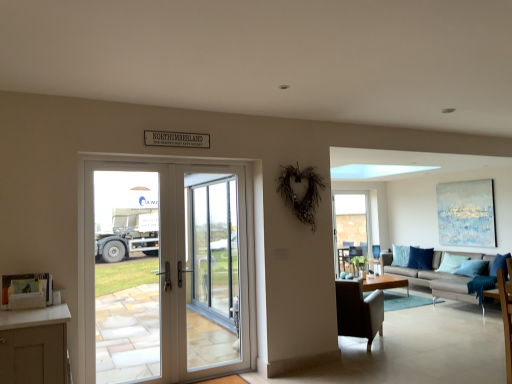
Find the location of a particular element. This screenshot has height=384, width=512. brown leather chair at center is located at coordinates (359, 310).

Identify the location of light gray fabric couch at center. The width and height of the screenshot is (512, 384). (438, 276).

At what (x,y) coordinates should I click in order to perform the action: click on clear glass window at right. Please return your answer as a coordinate pair (x, y). The image size is (512, 384). Looking at the image, I should click on (351, 223).

Does brown leather chair at center lie behind clear glass window at right?

No, it is in front of clear glass window at right.

From the image's perspective, relative to clear glass window at right, is brown leather chair at center above or below?

brown leather chair at center is situated lower than clear glass window at right in the image.

Which object is wider, brown leather chair at center or clear glass window at right?

brown leather chair at center.

Between brown leather chair at center and clear glass window at right, which one appears on the right side from the viewer's perspective?

From the viewer's perspective, clear glass window at right appears more on the right side.

Considering the relative positions of blue fabric pillow at right and light brown wooden coffee table at center in the image provided, is blue fabric pillow at right to the left or to the right of light brown wooden coffee table at center?

Clearly, blue fabric pillow at right is on the right of light brown wooden coffee table at center in the image.

Does blue fabric pillow at right have a larger size compared to light brown wooden coffee table at center?

No.

From a real-world perspective, which is physically below, blue fabric pillow at right or light brown wooden coffee table at center?

light brown wooden coffee table at center is physically lower.

Considering the sizes of objects blue fabric pillow at right and light brown wooden coffee table at center in the image provided, who is shorter, blue fabric pillow at right or light brown wooden coffee table at center?

light brown wooden coffee table at center.

Is blue textured canvas at upper right spatially inside brown leather chair at center, or outside of it?

blue textured canvas at upper right is spatially situated outside brown leather chair at center.

Considering the positions of objects blue textured canvas at upper right and brown leather chair at center in the image provided, who is behind, blue textured canvas at upper right or brown leather chair at center?

blue textured canvas at upper right is behind.

From a real-world perspective, is blue textured canvas at upper right positioned over brown leather chair at center based on gravity?

Yes, from a real-world perspective, blue textured canvas at upper right is above brown leather chair at center.

How distant is blue fabric pillow at right from white glossy screen door at center?

They are 4.84 meters apart.

Is white glossy screen door at center at the back of blue fabric pillow at right?

No, blue fabric pillow at right's orientation is not away from white glossy screen door at center.

Between point (459, 267) and point (224, 213), which one is positioned behind?

Positioned behind is point (459, 267).

Looking at their sizes, would you say blue fabric pillow at right is wider or thinner than white glossy screen door at center?

Result: In the image, blue fabric pillow at right appears to be wider than white glossy screen door at center.

Based on the photo, can you confirm if white glass door at center is thinner than blue fabric pillow at right?

Correct, the width of white glass door at center is less than that of blue fabric pillow at right.

Does white glass door at center appear on the left side of blue fabric pillow at right?

Yes, white glass door at center is to the left of blue fabric pillow at right.

Considering the sizes of objects white glass door at center and blue fabric pillow at right in the image provided, who is taller, white glass door at center or blue fabric pillow at right?

With more height is white glass door at center.

Would you say blue fabric pillow at right is part of white glass door at center's contents?

No, blue fabric pillow at right is not inside white glass door at center.

The width and height of the screenshot is (512, 384). In order to click on screen door to the right of white glass door at center in this screenshot , I will do `click(213, 266)`.

Is white glass door at center further to camera compared to white glossy screen door at center?

That is False.

Is white glass door at center at the left side of white glossy screen door at center?

Yes.

Based on their positions, is light gray fabric couch at center located to the left or right of blue textured canvas at upper right?

From the image, it's evident that light gray fabric couch at center is to the left of blue textured canvas at upper right.

Consider the image. From a real-world perspective, is light gray fabric couch at center physically below blue textured canvas at upper right?

Indeed, from a real-world perspective, light gray fabric couch at center is positioned beneath blue textured canvas at upper right.

Looking at this image, considering the sizes of objects light gray fabric couch at center and blue textured canvas at upper right in the image provided, who is smaller, light gray fabric couch at center or blue textured canvas at upper right?

With smaller size is blue textured canvas at upper right.

Identify the location of picture frame that is behind the light gray fabric couch at center. (466, 213).

Where is `chair that is on the left side of clear glass window at right`? chair that is on the left side of clear glass window at right is located at coordinates (359, 310).

Identify the location of pillow located behind the light brown wooden coffee table at center. (451, 263).

Which object lies further to the anchor point brown leather chair at center, white glossy screen door at center or light gray fabric couch at center?

Based on the image, light gray fabric couch at center appears to be further to brown leather chair at center.

Based on their spatial positions, is light brown wooden coffee table at center or blue textured canvas at upper right closer to white glass door at center?

light brown wooden coffee table at center is positioned closer to the anchor white glass door at center.

Considering their positions, is white glass door at center positioned closer to brown leather chair at center than white glossy screen door at center?

white glossy screen door at center is closer to brown leather chair at center.

In the scene shown: Based on their spatial positions, is blue fabric pillow at right or blue textured canvas at upper right closer to clear glass window at right?

Among the two, blue fabric pillow at right is located nearer to clear glass window at right.

Considering their positions, is blue textured canvas at upper right positioned closer to blue fabric pillow at right than white glass door at center?

blue textured canvas at upper right is closer to blue fabric pillow at right.

In the scene shown: Looking at the image, which one is located further to white glossy screen door at center, brown leather chair at center or light gray fabric couch at center?

light gray fabric couch at center is positioned further to the anchor white glossy screen door at center.

Looking at the image, which one is located closer to brown leather chair at center, blue fabric pillow at right or blue textured canvas at upper right?

blue textured canvas at upper right is positioned closer to the anchor brown leather chair at center.

Considering their positions, is white glossy screen door at center positioned closer to blue textured canvas at upper right than clear glass window at right?

clear glass window at right is positioned closer to the anchor blue textured canvas at upper right.

Locate an element on the screen. studio couch located between brown leather chair at center and light brown wooden coffee table at center in the depth direction is located at coordinates coord(438,276).

At what (x,y) coordinates should I click in order to perform the action: click on chair between white glossy screen door at center and clear glass window at right from front to back. Please return your answer as a coordinate pair (x, y). This screenshot has height=384, width=512. Looking at the image, I should click on (359, 310).

Find the location of a particular element. This screenshot has width=512, height=384. picture frame between light brown wooden coffee table at center and clear glass window at right from front to back is located at coordinates (466, 213).

Locate an element on the screen. The image size is (512, 384). coffee table between white glossy screen door at center and clear glass window at right in the front-back direction is located at coordinates (383, 282).